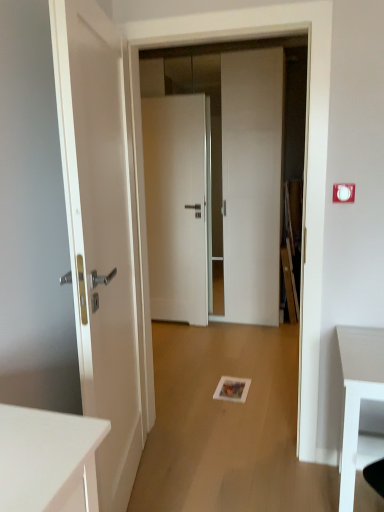
Question: Is white plastic electric outlet at upper right bigger or smaller than white glossy door at center, the second door when ordered from front to back?

Choices:
 (A) big
 (B) small

Answer: (B)

Question: Is point (347, 195) positioned closer to the camera than point (162, 200)?

Choices:
 (A) farther
 (B) closer

Answer: (B)

Question: Which object is positioned farthest from the white matte door at center, acting as the third door starting from the front?

Choices:
 (A) white glossy door at center, which ranks as the second door in back-to-front order
 (B) matte white door at left, acting as the 3th door starting from the back
 (C) white plastic electric outlet at upper right

Answer: (C)

Question: Estimate the real-world distances between objects in this image. Which object is closer to the white plastic electric outlet at upper right?

Choices:
 (A) matte white door at left, acting as the 3th door starting from the back
 (B) white matte door at center, which is counted as the first door, starting from the back
 (C) white glossy door at center, the second door when ordered from front to back

Answer: (A)